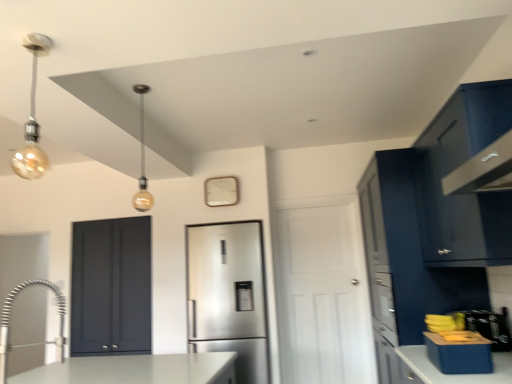
This screenshot has height=384, width=512. Identify the location of vacant region above white matte door at center, arranged as the 2th door when viewed from the left (from a real-world perspective). 313,201.